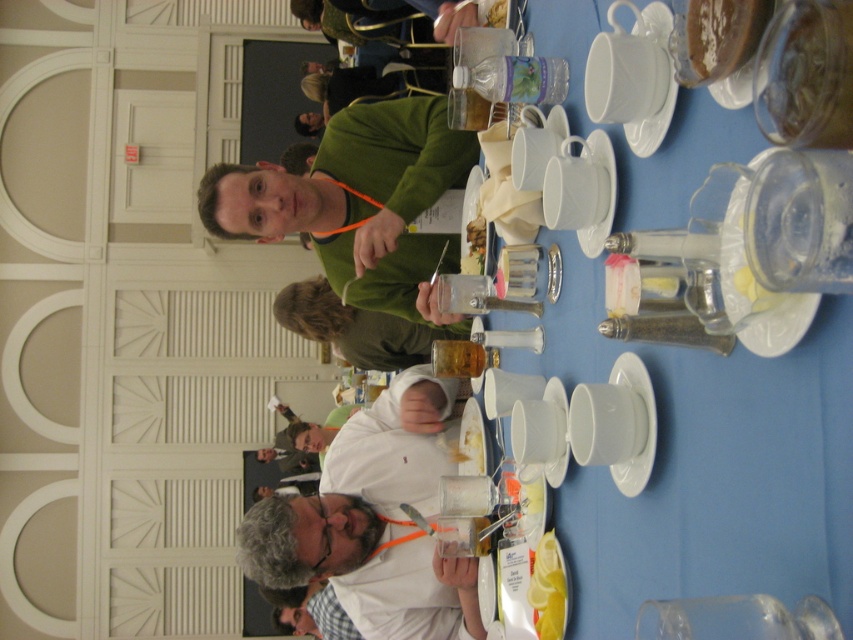
You are attending a formal event and notice two items labeled as the green matte sweater at upper center and the matte green sweater at upper center. Which one is closer to you?

The green matte sweater at upper center is closer to you because it is in front of the matte green sweater at upper center.

You are a guest at this event and need to identify the objects in the scene. Which object is taller, the white matte shirt at lower center or the shiny brown sauce at upper right?

The white matte shirt at lower center is taller than the shiny brown sauce at upper right.

You are at a social gathering and see two items labeled as green matte sweater at upper center and matte green sweater at upper center. Which one is positioned to the left?

The green matte sweater at upper center is positioned to the left of the matte green sweater at upper center.